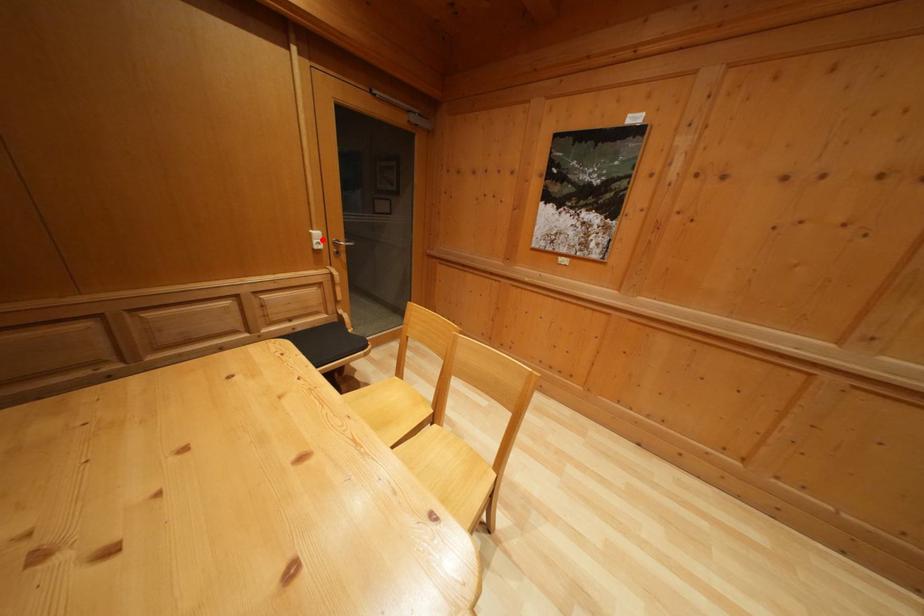
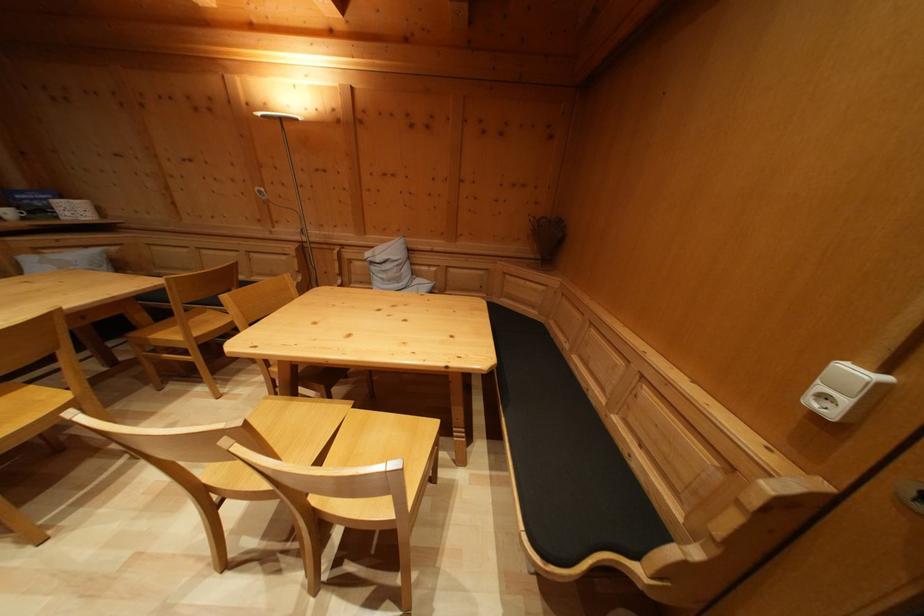
The point at the highlighted location is marked in the first image. Where is the corresponding point in the second image?

(859, 379)